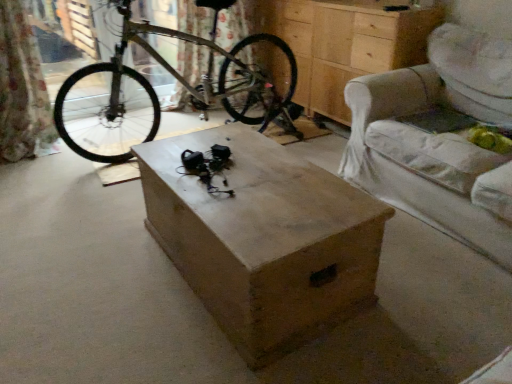
Question: Considering the relative sizes of light beige fabric armchair at right and wooden box at center in the image provided, is light beige fabric armchair at right taller than wooden box at center?

Choices:
 (A) no
 (B) yes

Answer: (B)

Question: Can you confirm if light beige fabric armchair at right is smaller than wooden box at center?

Choices:
 (A) yes
 (B) no

Answer: (B)

Question: Is wooden box at center located within light beige fabric armchair at right?

Choices:
 (A) yes
 (B) no

Answer: (B)

Question: Can you confirm if light beige fabric armchair at right is thinner than wooden box at center?

Choices:
 (A) no
 (B) yes

Answer: (A)

Question: Is the depth of light beige fabric armchair at right greater than that of wooden box at center?

Choices:
 (A) yes
 (B) no

Answer: (A)

Question: Based on their sizes in the image, would you say wooden box at center is bigger or smaller than silver metallic bicycle at center?

Choices:
 (A) small
 (B) big

Answer: (A)

Question: Does point (344, 269) appear closer or farther from the camera than point (251, 49)?

Choices:
 (A) farther
 (B) closer

Answer: (B)

Question: Considering the positions of wooden box at center and silver metallic bicycle at center in the image, is wooden box at center wider or thinner than silver metallic bicycle at center?

Choices:
 (A) thin
 (B) wide

Answer: (A)

Question: Visually, is wooden box at center positioned to the left or to the right of silver metallic bicycle at center?

Choices:
 (A) left
 (B) right

Answer: (B)

Question: Is wooden chest of drawers at center wider or thinner than light beige fabric armchair at right?

Choices:
 (A) wide
 (B) thin

Answer: (B)

Question: From a real-world perspective, is wooden chest of drawers at center physically located above or below light beige fabric armchair at right?

Choices:
 (A) above
 (B) below

Answer: (A)

Question: Is point (321, 52) positioned closer to the camera than point (509, 213)?

Choices:
 (A) farther
 (B) closer

Answer: (A)

Question: Is wooden chest of drawers at center taller or shorter than light beige fabric armchair at right?

Choices:
 (A) short
 (B) tall

Answer: (B)

Question: Relative to light beige fabric armchair at right, is silver metallic bicycle at center in front or behind?

Choices:
 (A) front
 (B) behind

Answer: (B)

Question: Is silver metallic bicycle at center wider or thinner than light beige fabric armchair at right?

Choices:
 (A) wide
 (B) thin

Answer: (A)